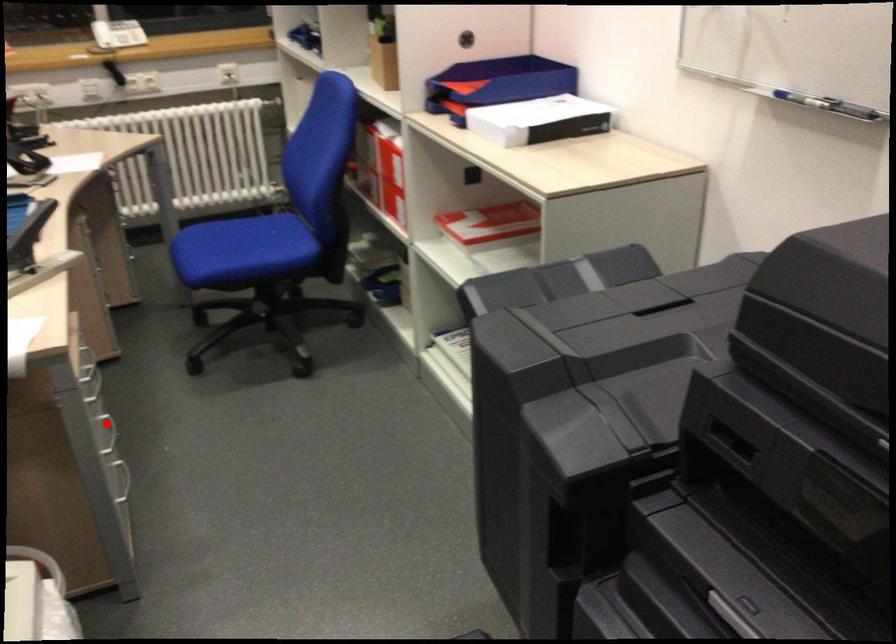
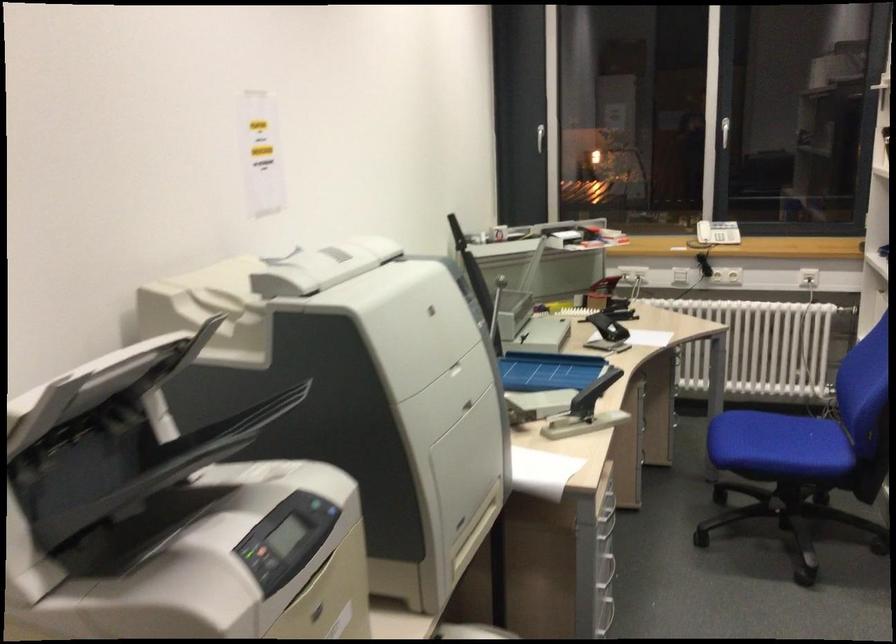
Question: I am providing you with two images of the same scene from different viewpoints. In image1, a red point is highlighted. Considering the same 3D point in image2, which of the following is correct?

Choices:
 (A) It is closer
 (B) It is farther

Answer: (B)